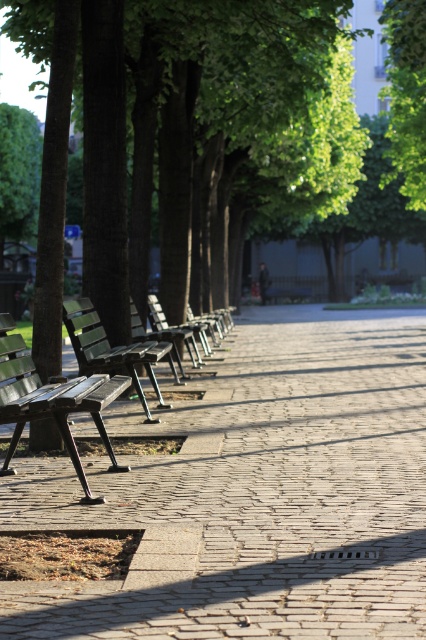
Between wooden park bench at left and wooden park bench at center, which one appears on the right side from the viewer's perspective?

wooden park bench at center

Which is more to the left, wooden park bench at left or wooden park bench at center?

wooden park bench at left is more to the left.

Who is more forward, (x=51, y=376) or (x=143, y=362)?

Positioned in front is point (x=51, y=376).

This screenshot has height=640, width=426. In order to click on wooden park bench at left in this screenshot , I will do `click(51, 401)`.

Between wooden park bench at center and wooden bench at center, which one has less height?

Standing shorter between the two is wooden bench at center.

Between wooden park bench at center and wooden bench at center, which one is positioned higher?

wooden bench at center is higher up.

You are a GUI agent. You are given a task and a screenshot of the screen. Output one action in this format:
    pyautogui.click(x=<x>, y=<y>)
    Task: Click on the wooden park bench at center
    
    Given the screenshot: What is the action you would take?
    pyautogui.click(x=112, y=349)

Find the location of `wooden park bench at center`. wooden park bench at center is located at coordinates (112, 349).

Which is below, brick paved walkway at center or wooden bench at center?

brick paved walkway at center is below.

Can you confirm if brick paved walkway at center is taller than wooden bench at center?

Yes, brick paved walkway at center is taller than wooden bench at center.

This screenshot has width=426, height=640. What are the coordinates of `brick paved walkway at center` in the screenshot? It's located at (255, 493).